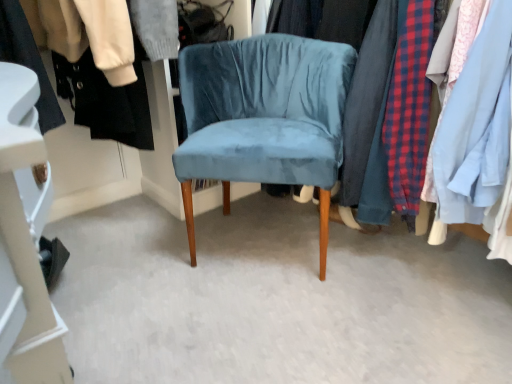
Identify the location of free spot in front of velvet blue chair at center. (275, 327).